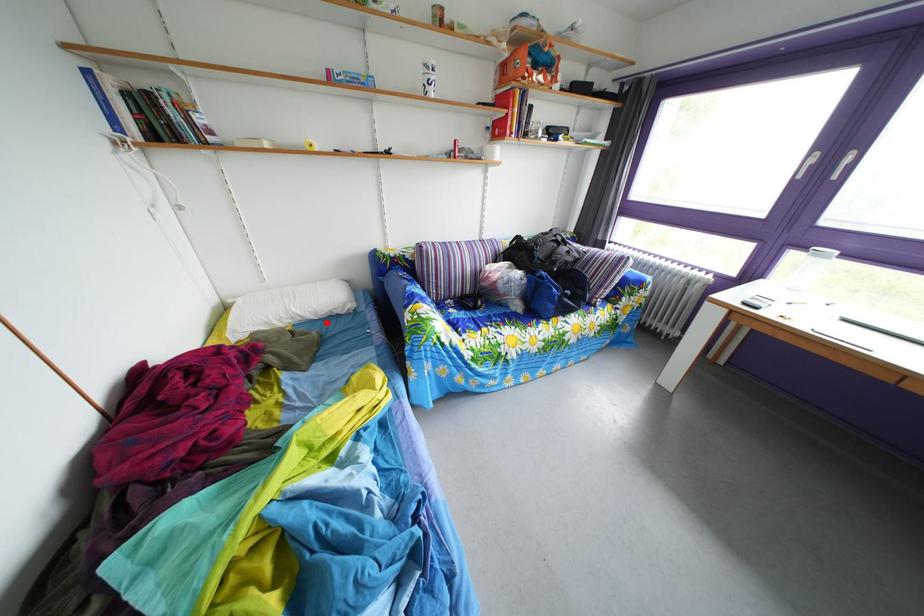
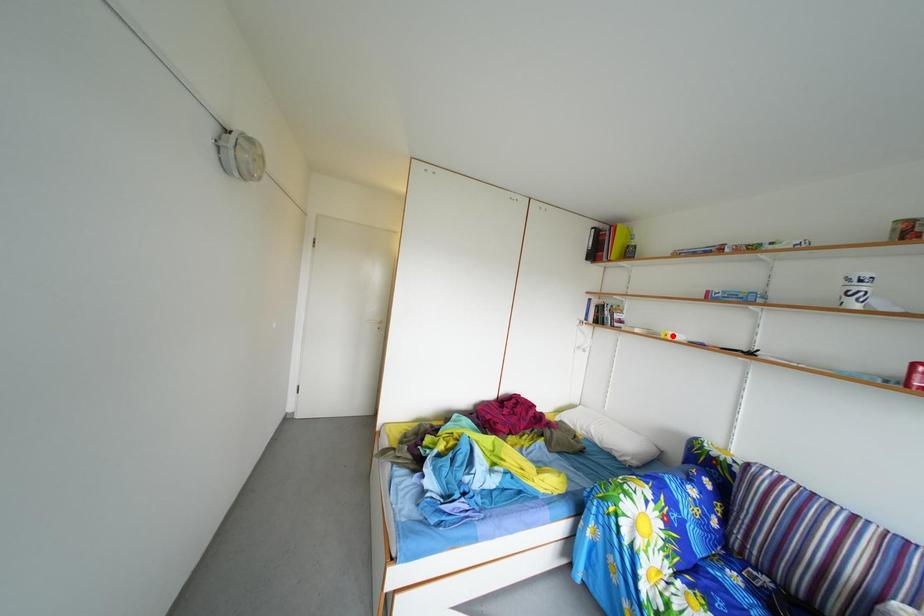
I am providing you with two images of the same scene from different viewpoints. A red point is marked on the first image and another point is marked on the second image. Is the marked point in image1 the same physical position as the marked point in image2?

No